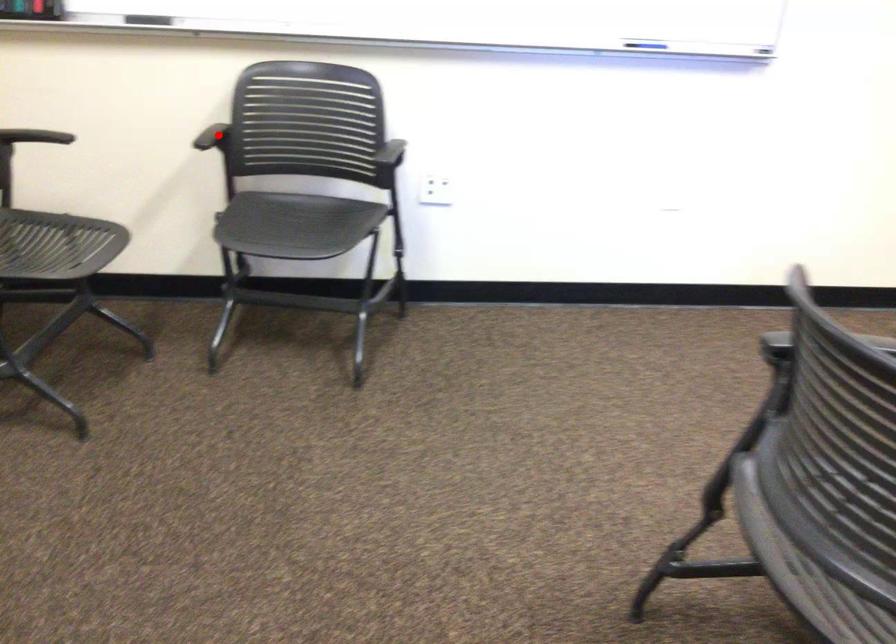
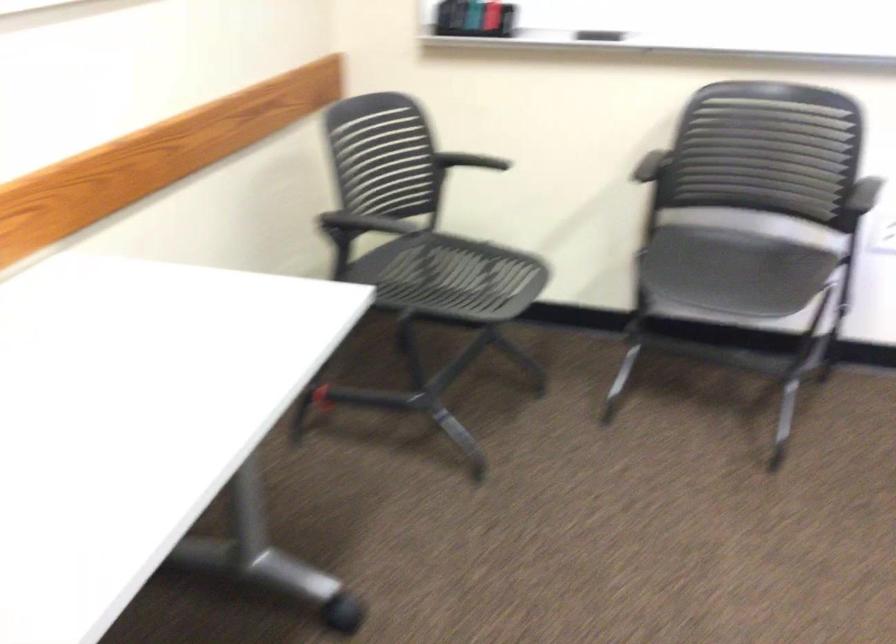
Question: I am providing you with two images of the same scene from different viewpoints. Image1 has a red point marked. In image2, the corresponding 3D location appears at what relative position? Reply with the corresponding letter.

Choices:
 (A) Closer
 (B) Farther

Answer: (A)